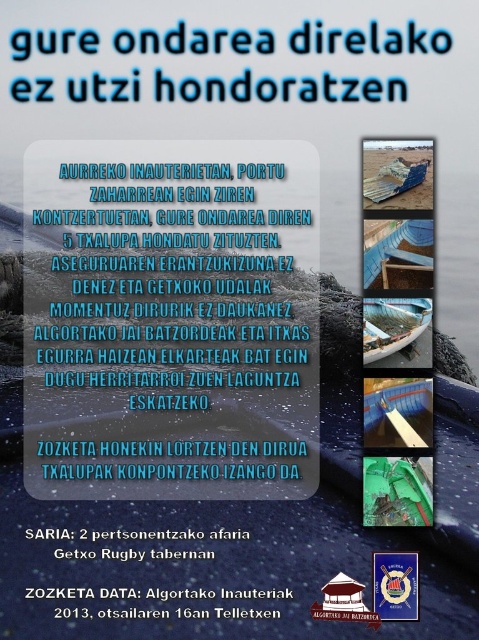
You are designing a layout for a promotional poster and need to ensure the blue corrugated metal boat at upper center and the black paper text at lower center are positioned correctly. According to the spatial arrangement, which object is located to the right of the other?

The blue corrugated metal boat at upper center is to the right of the black paper text at lower center.

You are designing a layout for a promotional poster and need to ensure the blue corrugated metal boat at upper center and the black paper text at lower center are placed correctly. According to the design guidelines, which object should be placed higher on the poster?

The blue corrugated metal boat at upper center should be placed higher on the poster because it is positioned over the black paper text at lower center.

You are designing a poster and want to ensure the blue plastic text at upper center and the black paper text at lower center are visible. Which text should you adjust to make it larger to ensure readability?

The blue plastic text at upper center is already taller than the black paper text at lower center. To ensure readability, you might consider increasing the size of the black paper text at lower center if it is too small, but according to the description, it is shorter. However, since the question asks to adjust to make it larger, perhaps the blue plastic text could be made even larger for better emphasis.